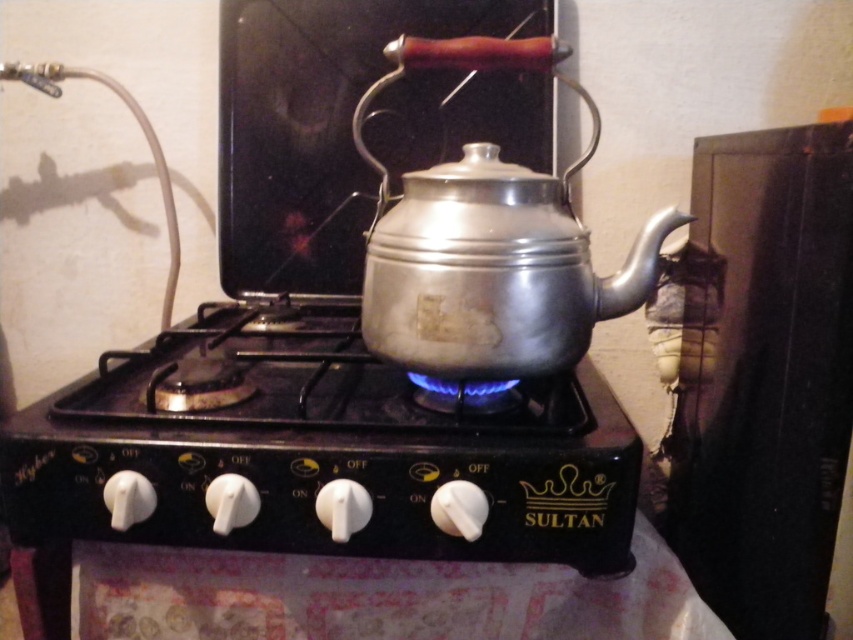
Does black matte stove at center have a greater height compared to silver metallic teapot at center?

Incorrect, black matte stove at center's height is not larger of silver metallic teapot at center's.

Which of these two, black matte stove at center or silver metallic teapot at center, stands shorter?

black matte stove at center is shorter.

Between point (279, 500) and point (421, 234), which one is positioned in front?

Point (279, 500) is more forward.

Identify the location of black matte stove at center. (323, 451).

Between point (489, 516) and point (178, 410), which one is positioned in front?

Point (489, 516)

Is point (288, 474) positioned before point (241, 390)?

Yes, it is in front of point (241, 390).

This screenshot has height=640, width=853. What are the coordinates of `black matte stove at center` in the screenshot? It's located at (323, 451).

Is silver metallic teapot at center smaller than shiny metallic kettle at center?

Incorrect, silver metallic teapot at center is not smaller in size than shiny metallic kettle at center.

Which of these two, silver metallic teapot at center or shiny metallic kettle at center, stands taller?

Standing taller between the two is silver metallic teapot at center.

Identify the location of silver metallic teapot at center. The height and width of the screenshot is (640, 853). (489, 243).